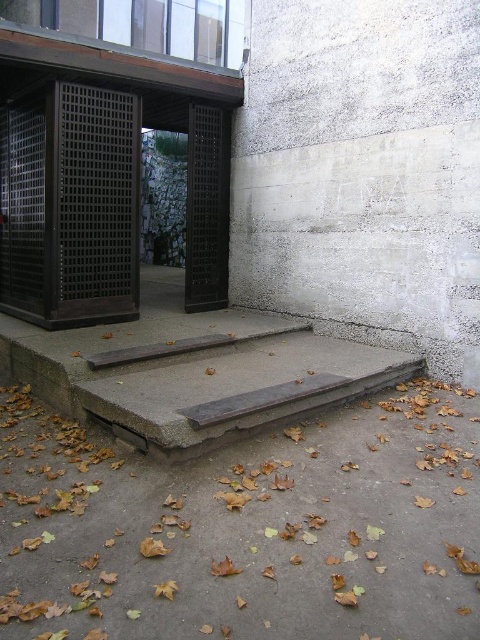
Question: Does concrete/stained wood stairs at center have a larger size compared to brown wooden rail at center?

Choices:
 (A) yes
 (B) no

Answer: (A)

Question: Which point is closer to the camera taking this photo?

Choices:
 (A) pyautogui.click(x=121, y=358)
 (B) pyautogui.click(x=117, y=362)

Answer: (B)

Question: Is concrete/stained wood stairs at center closer to the viewer compared to brown wooden rail at center?

Choices:
 (A) no
 (B) yes

Answer: (B)

Question: Which object is closer to the camera taking this photo?

Choices:
 (A) concrete/stained wood stairs at center
 (B) brown wooden rail at center

Answer: (A)

Question: Which of the following is the closest to the observer?

Choices:
 (A) (268, 330)
 (B) (224, 376)

Answer: (B)

Question: Does concrete/stained wood stairs at center lie in front of brown wooden rail at center?

Choices:
 (A) no
 (B) yes

Answer: (B)